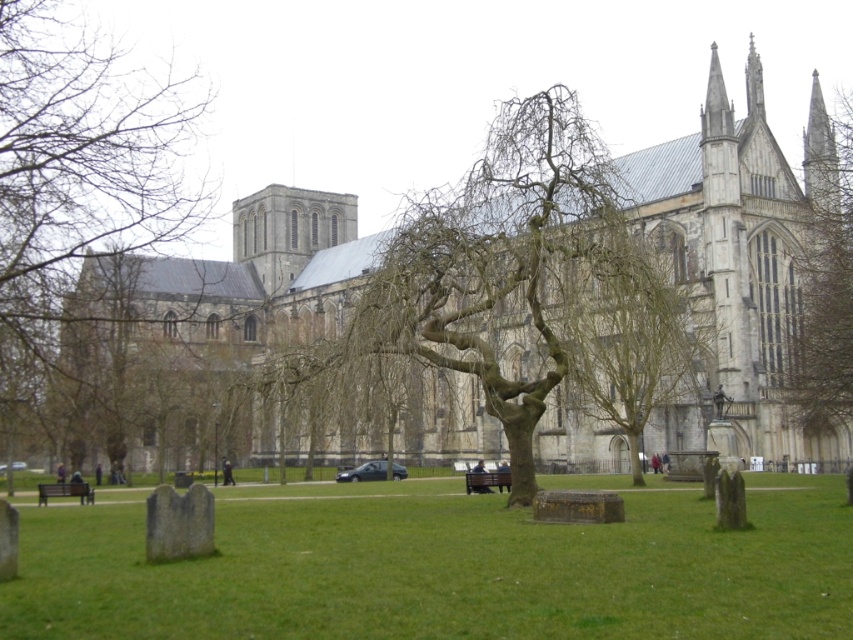
Question: Considering the relative positions of wooden bench at lower left and wooden park bench at center in the image provided, where is wooden bench at lower left located with respect to wooden park bench at center?

Choices:
 (A) right
 (B) left

Answer: (B)

Question: Which object appears farthest from the camera in this image?

Choices:
 (A) wooden park bench at center
 (B) wooden bench at lower left

Answer: (B)

Question: Does bare branches at center have a lesser width compared to bare branches at right?

Choices:
 (A) yes
 (B) no

Answer: (A)

Question: From the image, what is the correct spatial relationship of bare branches at right in relation to wooden bench at lower left?

Choices:
 (A) left
 (B) right

Answer: (B)

Question: Estimate the real-world distances between objects in this image. Which object is closer to the green grass at lower center?

Choices:
 (A) bare wood tree at center
 (B) bare branches at right
 (C) bare branches at center

Answer: (A)

Question: Estimate the real-world distances between objects in this image. Which object is farther from the wooden bench at lower left?

Choices:
 (A) bare branches at left
 (B) wooden park bench at center
 (C) bare branches at right

Answer: (C)